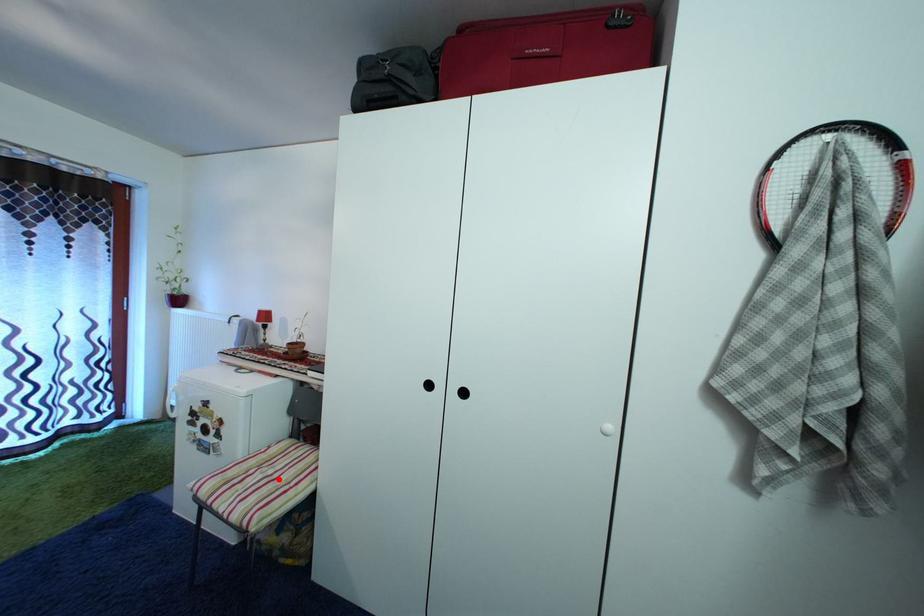
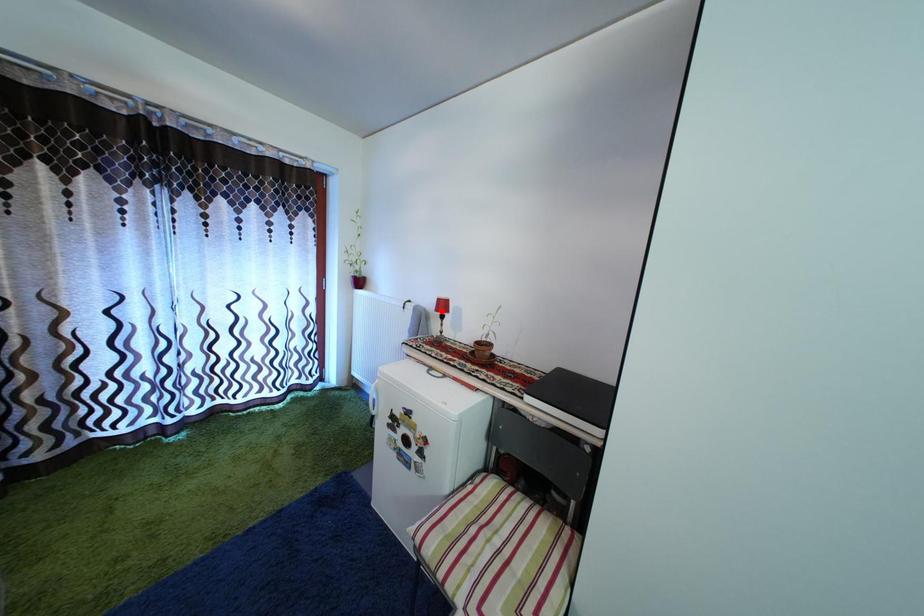
I am providing you with two images of the same scene from different viewpoints. A red point is marked on the first image and another point is marked on the second image. Does the point marked in image1 correspond to the same location as the one in image2?

No